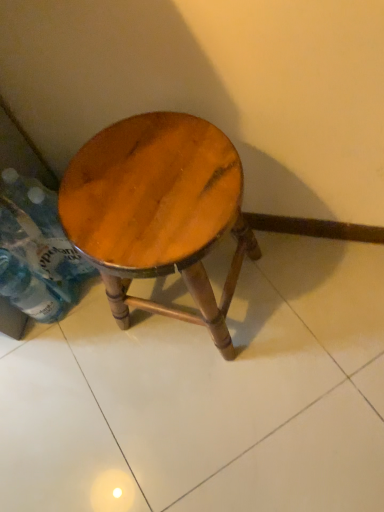
Question: Can you confirm if clear plastic bottle at lower left, the second bottle positioned from the top, is shorter than wooden stool at center?

Choices:
 (A) yes
 (B) no

Answer: (A)

Question: Is clear plastic bottle at lower left, the 1th bottle when ordered from bottom to top, not near wooden stool at center?

Choices:
 (A) no
 (B) yes

Answer: (A)

Question: Is clear plastic bottle at lower left, the 1th bottle when ordered from bottom to top, looking in the opposite direction of wooden stool at center?

Choices:
 (A) no
 (B) yes

Answer: (A)

Question: Is clear plastic bottle at lower left, the 1th bottle when ordered from bottom to top, to the right of wooden stool at center from the viewer's perspective?

Choices:
 (A) yes
 (B) no

Answer: (B)

Question: Is clear plastic bottle at lower left, the 1th bottle when ordered from bottom to top, located outside wooden stool at center?

Choices:
 (A) no
 (B) yes

Answer: (B)

Question: Is translucent plastic bottle at lower left, placed as the 1th bottle when sorted from top to bottom, to the left or to the right of wooden stool at center in the image?

Choices:
 (A) right
 (B) left

Answer: (B)

Question: Looking at their shapes, would you say translucent plastic bottle at lower left, placed as the 1th bottle when sorted from top to bottom, is wider or thinner than wooden stool at center?

Choices:
 (A) thin
 (B) wide

Answer: (A)

Question: Does point (39, 212) appear closer or farther from the camera than point (157, 112)?

Choices:
 (A) farther
 (B) closer

Answer: (A)

Question: In the image, is translucent plastic bottle at lower left, placed as the 1th bottle when sorted from top to bottom, positioned in front of or behind wooden stool at center?

Choices:
 (A) front
 (B) behind

Answer: (B)

Question: From a real-world perspective, is clear plastic bottle at lower left, the second bottle positioned from the top, above or below wooden stool at center?

Choices:
 (A) above
 (B) below

Answer: (B)

Question: In terms of height, does clear plastic bottle at lower left, the 1th bottle when ordered from bottom to top, look taller or shorter compared to wooden stool at center?

Choices:
 (A) tall
 (B) short

Answer: (B)

Question: Is clear plastic bottle at lower left, the 1th bottle when ordered from bottom to top, bigger or smaller than wooden stool at center?

Choices:
 (A) small
 (B) big

Answer: (A)

Question: Is clear plastic bottle at lower left, the second bottle positioned from the top, to the left or to the right of wooden stool at center in the image?

Choices:
 (A) right
 (B) left

Answer: (B)

Question: Is wooden stool at center spatially inside clear plastic bottle at lower left, the 1th bottle when ordered from bottom to top, or outside of it?

Choices:
 (A) outside
 (B) inside

Answer: (A)

Question: From a real-world perspective, is wooden stool at center positioned above or below clear plastic bottle at lower left, the 1th bottle when ordered from bottom to top?

Choices:
 (A) above
 (B) below

Answer: (A)